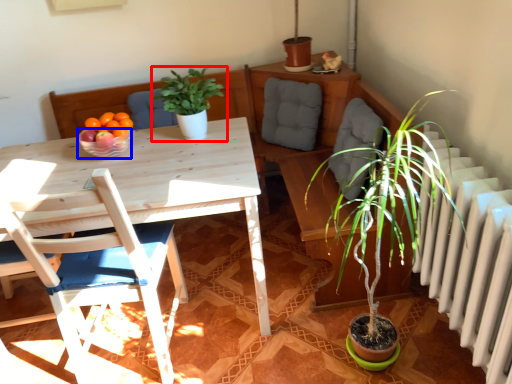
Question: Which object appears closest to the camera in this image, houseplant (highlighted by a red box) or bowl (highlighted by a blue box)?

Choices:
 (A) houseplant
 (B) bowl

Answer: (A)